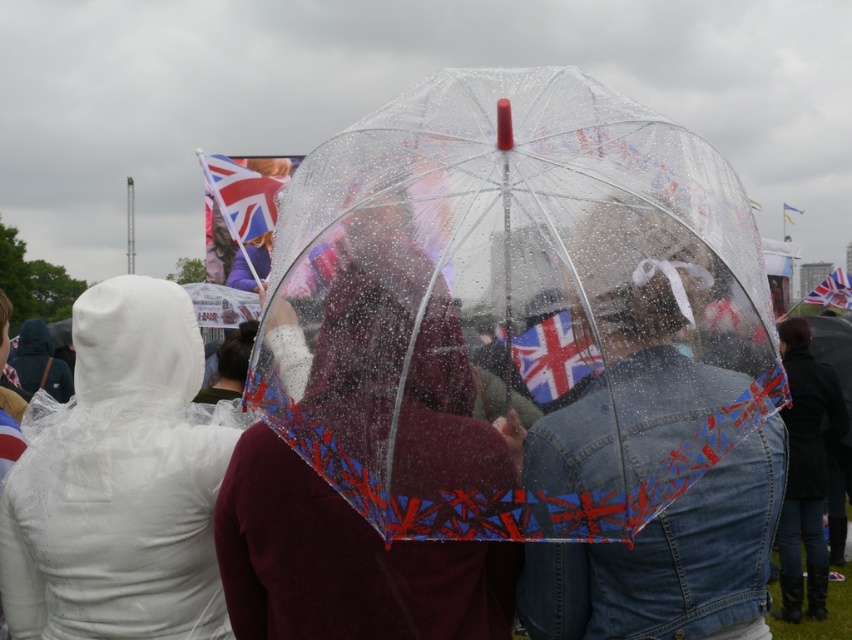
Based on the photo, you are standing in the scene and want to walk towards the point that is closer to you. Which point should you head towards, point (626, 125) or point (839, 285)?

You should head towards point (626, 125) because it is closer to the viewer than point (839, 285).